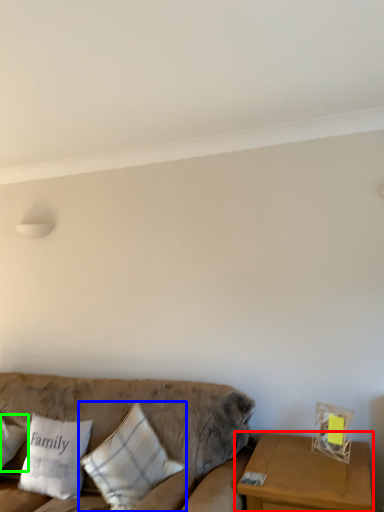
Question: Estimate the real-world distances between objects in this image. Which object is closer to table (highlighted by a red box), pillow (highlighted by a blue box) or pillow (highlighted by a green box)?

Choices:
 (A) pillow
 (B) pillow

Answer: (A)